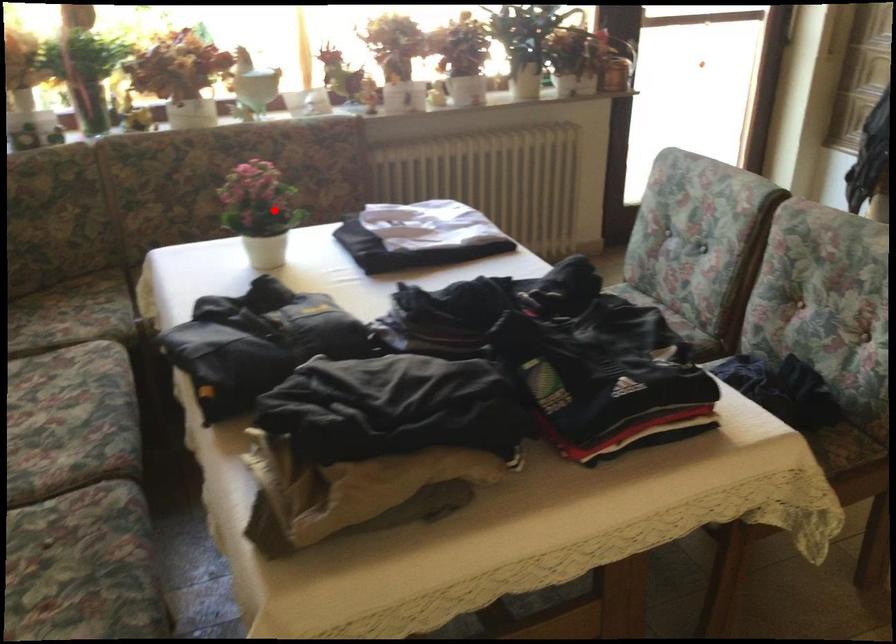
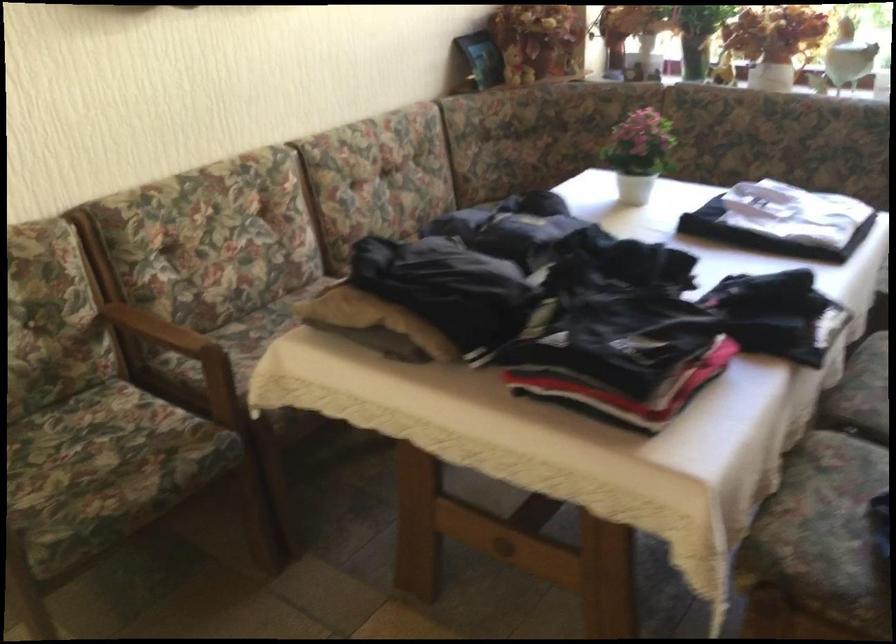
Question: A red point is marked in image1. In image2, is the corresponding 3D point closer to the camera or farther? Reply with the corresponding letter.

Choices:
 (A) The corresponding 3D point is closer.
 (B) The corresponding 3D point is farther.

Answer: (B)